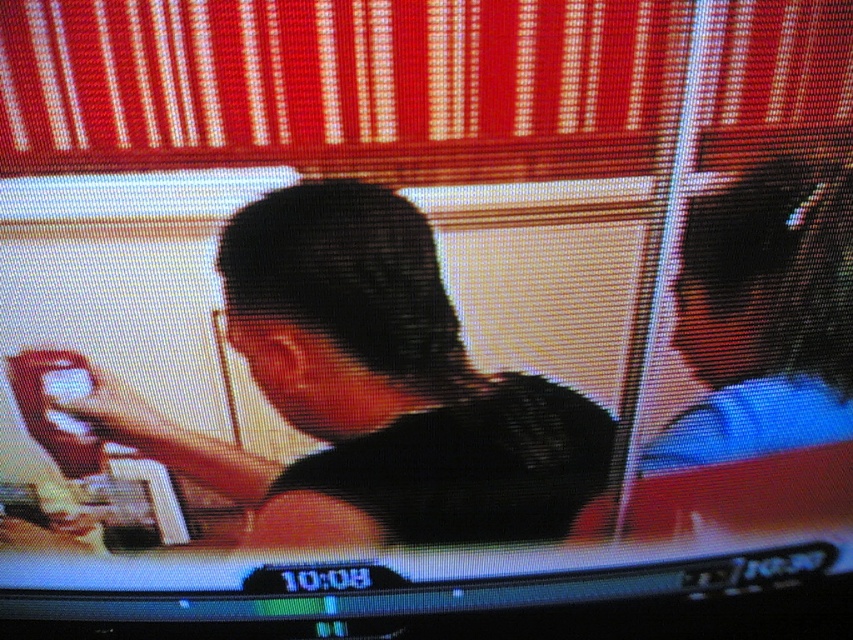
You are a security guard monitoring the camera feed. You notice two objects on the screen, the black matte shirt at center and the matte black hair at upper right. Which one appears taller in the camera feed?

The black matte shirt at center appears taller than the matte black hair at upper right in the camera feed.

Based on the scene described, which object, the black matte shirt at center or the matte black hair at upper right, has a greater width?

The black matte shirt at center has a greater width than the matte black hair at upper right.

You are analyzing a security camera feed and notice two points of interest marked as point 1 at coordinates (189,436) and point 2 at coordinates (824,216). Based on the image, which point is closer to the camera?

Point 1 at coordinates (189,436) is closer to the camera than point 2 at coordinates (824,216).